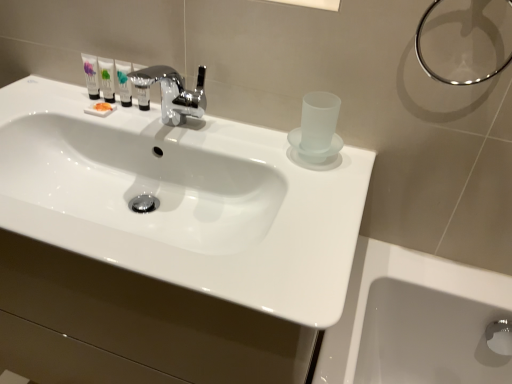
Identify the location of vacant area that lies to the right of matte white tube at upper left, which ranks as the 3th mouthwash in right-to-left order. (177, 127).